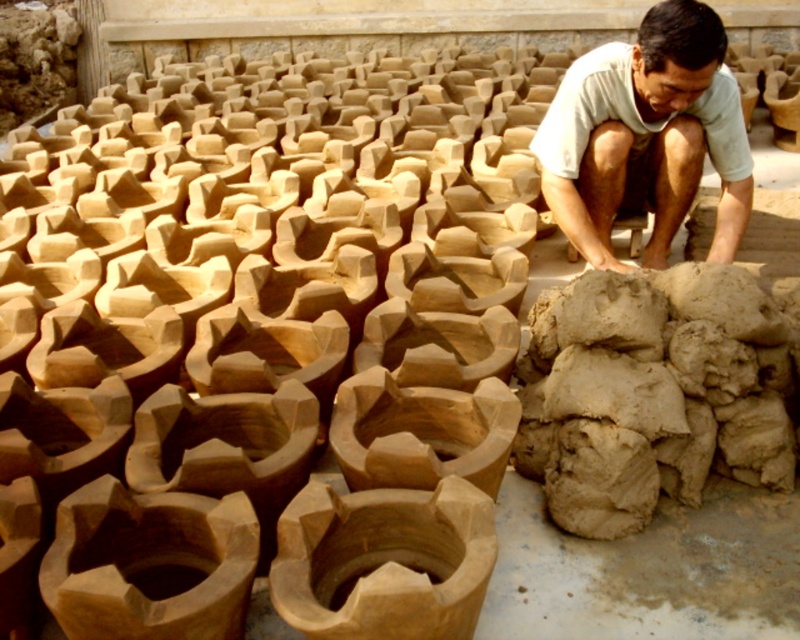
Question: Among these points, which one is farthest from the camera?

Choices:
 (A) (568, 205)
 (B) (694, 340)

Answer: (A)

Question: Which of the following is the closest to the observer?

Choices:
 (A) (678, 116)
 (B) (636, 449)

Answer: (B)

Question: Which object appears closest to the camera in this image?

Choices:
 (A) clay at lower right
 (B) light brown clay at center

Answer: (A)

Question: Does clay at lower right appear on the left side of light brown clay at center?

Choices:
 (A) no
 (B) yes

Answer: (B)

Question: Does clay at lower right have a smaller size compared to light brown clay at center?

Choices:
 (A) no
 (B) yes

Answer: (B)

Question: Is clay at lower right thinner than light brown clay at center?

Choices:
 (A) no
 (B) yes

Answer: (A)